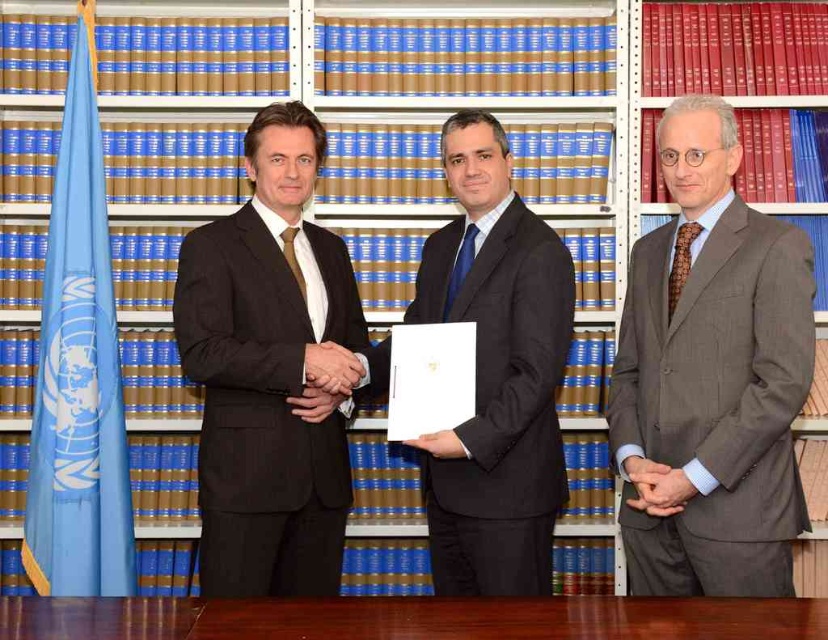
Question: Is dark gray suit at center smaller than smooth leather wallet at center?

Choices:
 (A) yes
 (B) no

Answer: (B)

Question: Among these points, which one is nearest to the camera?

Choices:
 (A) (756, 580)
 (B) (326, 627)
 (C) (225, 593)
 (D) (328, 376)

Answer: (B)

Question: Which point appears closest to the camera in this image?

Choices:
 (A) pyautogui.click(x=451, y=429)
 (B) pyautogui.click(x=359, y=372)
 (C) pyautogui.click(x=244, y=317)
 (D) pyautogui.click(x=331, y=608)

Answer: (D)

Question: Can you confirm if black satin suit at center is positioned to the left of dark gray suit at center?

Choices:
 (A) yes
 (B) no

Answer: (A)

Question: Which of the following is the closest to the observer?

Choices:
 (A) (339, 561)
 (B) (643, 460)
 (C) (352, 616)
 (D) (450, 440)

Answer: (C)

Question: Observing the image, what is the correct spatial positioning of gray pinstripe suit at right in reference to smooth leather hand at center?

Choices:
 (A) left
 (B) right

Answer: (B)